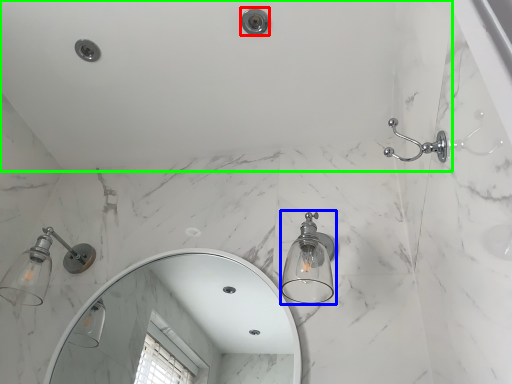
Question: Which object is the farthest from shower (highlighted by a red box)? Choose among these: light fixture (highlighted by a blue box) or bath (highlighted by a green box).

Choices:
 (A) light fixture
 (B) bath

Answer: (A)